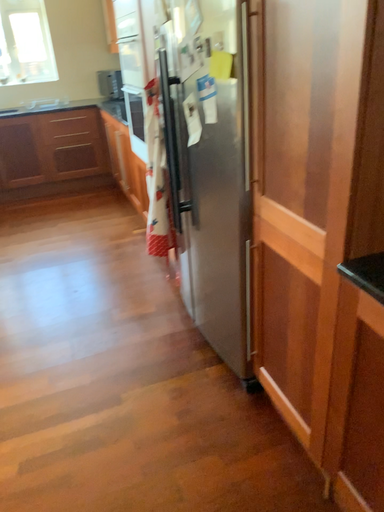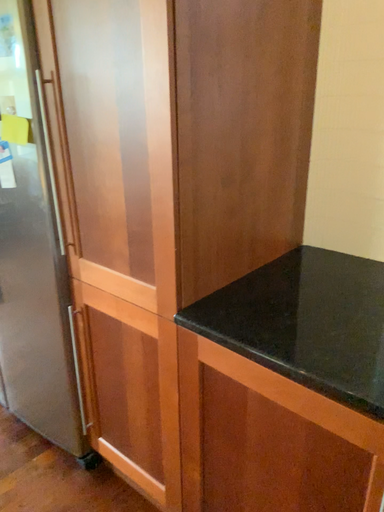
Question: How did the camera likely rotate when shooting the video?

Choices:
 (A) rotated left
 (B) rotated right

Answer: (B)